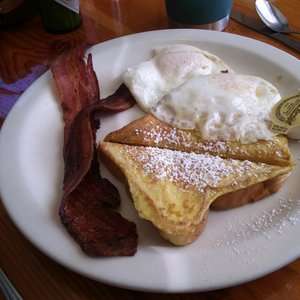
Where is `cup`? The image size is (300, 300). cup is located at coordinates (206, 14).